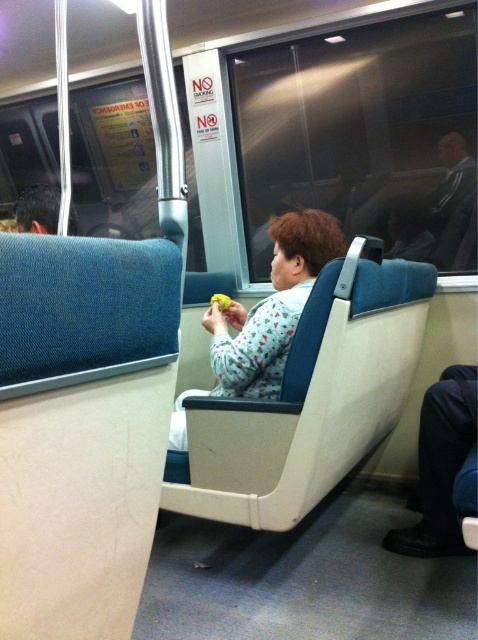
Who is higher up, floral-patterned fabric at center or dark gray suit at upper right?

dark gray suit at upper right is higher up.

The width and height of the screenshot is (478, 640). What are the coordinates of `floral-patterned fabric at center` in the screenshot? It's located at (264, 316).

Where is `floral-patterned fabric at center`? floral-patterned fabric at center is located at coordinates (264, 316).

Can you confirm if black leather shoe at lower right is taller than dark brown hair at upper left?

Yes, black leather shoe at lower right is taller than dark brown hair at upper left.

Based on the photo, is black leather shoe at lower right smaller than dark brown hair at upper left?

Incorrect, black leather shoe at lower right is not smaller in size than dark brown hair at upper left.

This screenshot has height=640, width=478. In order to click on black leather shoe at lower right in this screenshot , I will do `click(441, 465)`.

The image size is (478, 640). In order to click on black leather shoe at lower right in this screenshot , I will do `click(441, 465)`.

What do you see at coordinates (441, 465) in the screenshot? I see `black leather shoe at lower right` at bounding box center [441, 465].

Can you confirm if black leather shoe at lower right is thinner than dark gray suit at upper right?

In fact, black leather shoe at lower right might be wider than dark gray suit at upper right.

Between point (445, 540) and point (458, 262), which one is positioned behind?

The point (458, 262) is behind.

Image resolution: width=478 pixels, height=640 pixels. What are the coordinates of `black leather shoe at lower right` in the screenshot? It's located at (441, 465).